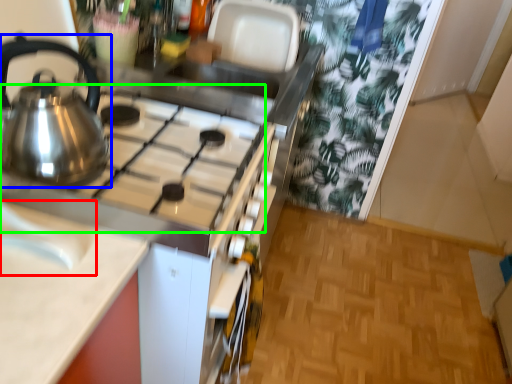
Question: Which object is the closest to the sink (highlighted by a red box)? Choose among these: kettle (highlighted by a blue box) or gas stove (highlighted by a green box).

Choices:
 (A) kettle
 (B) gas stove

Answer: (A)